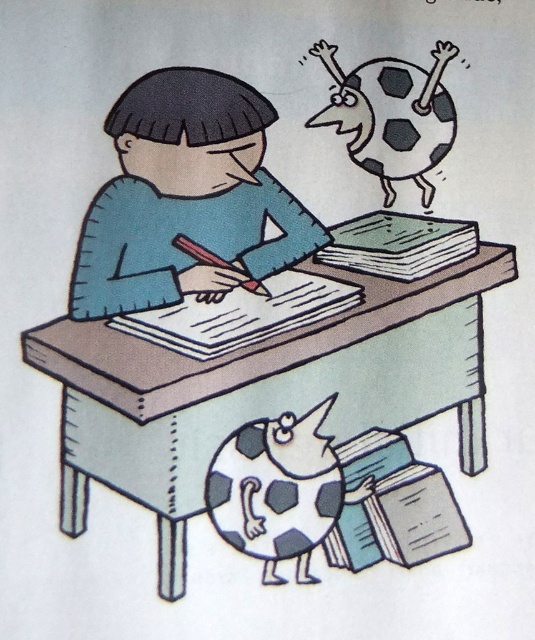
Between blue matte shirt at center and patterned soccer ball at lower center, which one appears on the left side from the viewer's perspective?

blue matte shirt at center is more to the left.

Is blue matte shirt at center to the right of patterned soccer ball at lower center from the viewer's perspective?

Incorrect, blue matte shirt at center is not on the right side of patterned soccer ball at lower center.

Which is behind, point (101, 241) or point (310, 452)?

Positioned behind is point (101, 241).

Locate an element on the screen. This screenshot has height=640, width=535. blue matte shirt at center is located at coordinates (186, 196).

Consider the image. Which is more to the left, light brown wooden table at center or blue matte shirt at center?

blue matte shirt at center

Who is taller, light brown wooden table at center or blue matte shirt at center?

light brown wooden table at center is taller.

Is point (347, 250) closer to camera compared to point (113, 259)?

No, it is behind (113, 259).

You are a GUI agent. You are given a task and a screenshot of the screen. Output one action in this format:
    pyautogui.click(x=<x>, y=<y>)
    Task: Click on the light brown wooden table at center
    The width and height of the screenshot is (535, 640).
    Given the screenshot: What is the action you would take?
    [287, 396]

Is blue matte shirt at center taller than black and white spotted figure at upper right?

Yes.

Does blue matte shirt at center have a smaller size compared to black and white spotted figure at upper right?

Actually, blue matte shirt at center might be larger than black and white spotted figure at upper right.

Image resolution: width=535 pixels, height=640 pixels. I want to click on blue matte shirt at center, so click(x=186, y=196).